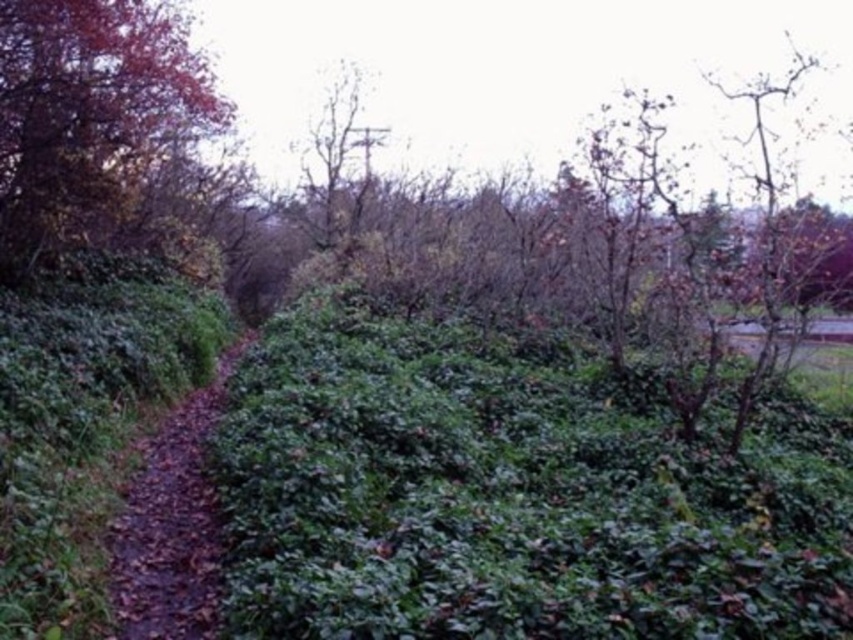
You are an outdoor photographer planning to capture a shot of the brown dirt path at center and the bare wood tree at center. Based on the scene, which object should appear closer to the camera in your photo?

The brown dirt path at center is in front of the bare wood tree at center, so it will appear closer to the camera in the photo.

You are a hiker trying to find your way through the autumn forest. You see a green leafy hedge at center and a shiny red leaves at upper left. Which object is located to the right of the other?

The green leafy hedge at center is positioned on the right side of shiny red leaves at upper left.

You are a gardener planning to trim both the green leafy hedge at center and the shiny red leaves at upper left. Based on their sizes, which one requires more time and effort?

The green leafy hedge at center requires more time and effort because it has a larger size compared to the shiny red leaves at upper left.